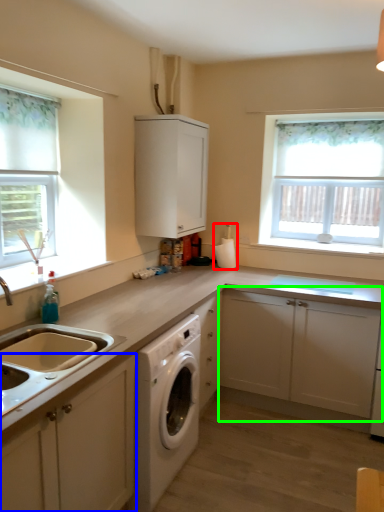
Question: Based on their relative distances, which object is nearer to appliance (highlighted by a red box)? Choose from cabinetry (highlighted by a blue box) and cabinetry (highlighted by a green box).

Choices:
 (A) cabinetry
 (B) cabinetry

Answer: (B)